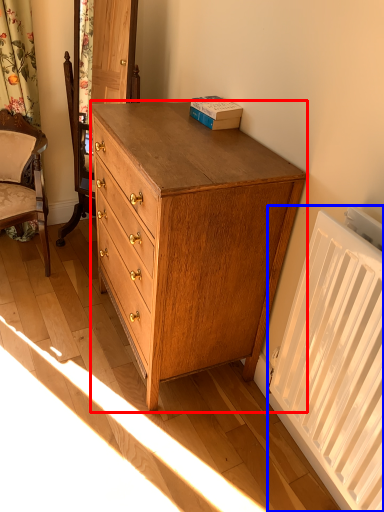
Question: Which object is closer to the camera taking this photo, chest of drawers (highlighted by a red box) or radiator (highlighted by a blue box)?

Choices:
 (A) chest of drawers
 (B) radiator

Answer: (B)